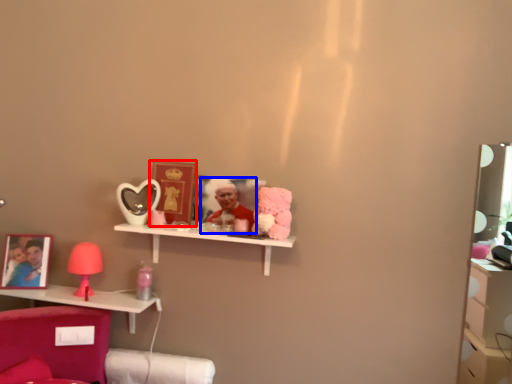
Question: Which object appears closest to the camera in this image, picture frame (highlighted by a red box) or person (highlighted by a blue box)?

Choices:
 (A) picture frame
 (B) person

Answer: (B)